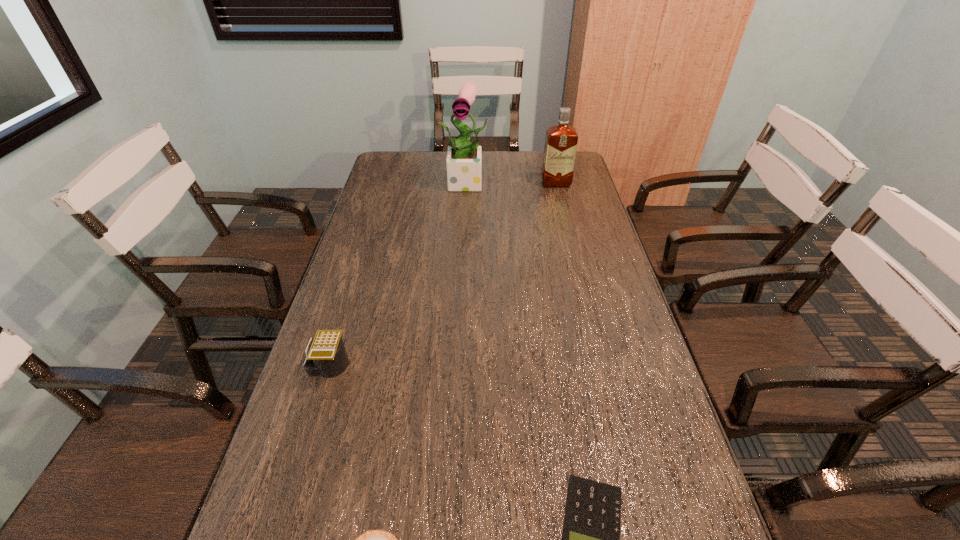
The image size is (960, 540). Find the location of `object located at the right edge`. object located at the right edge is located at coordinates (561, 140).

The height and width of the screenshot is (540, 960). Find the location of `object at the far right corner`. object at the far right corner is located at coordinates pyautogui.click(x=561, y=140).

This screenshot has height=540, width=960. Identify the location of free location at the far edge. (424, 157).

Image resolution: width=960 pixels, height=540 pixels. In order to click on free space at the left edge of the desktop in this screenshot , I will do `click(381, 261)`.

Locate an element on the screen. Image resolution: width=960 pixels, height=540 pixels. vacant space at the right edge of the desktop is located at coordinates (596, 315).

This screenshot has height=540, width=960. In the image, there is a desktop. What are the coordinates of `free space at the far left corner` in the screenshot? It's located at (418, 161).

In the image, there is a desktop. Where is `vacant space at the far right corner`? vacant space at the far right corner is located at coordinates (579, 167).

You are a GUI agent. You are given a task and a screenshot of the screen. Output one action in this format:
    pyautogui.click(x=<x>, y=<y>)
    Task: Click on the empty space that is in between the tallest object and the second tallest object
    
    Given the screenshot: What is the action you would take?
    pyautogui.click(x=513, y=183)

In order to click on free space between the second tallest object and the tallest object in this screenshot , I will do `click(513, 183)`.

At what (x,y) coordinates should I click in order to perform the action: click on free spot between the tallest object and the leftmost object. Please return your answer as a coordinate pair (x, y). Image resolution: width=960 pixels, height=540 pixels. Looking at the image, I should click on (398, 274).